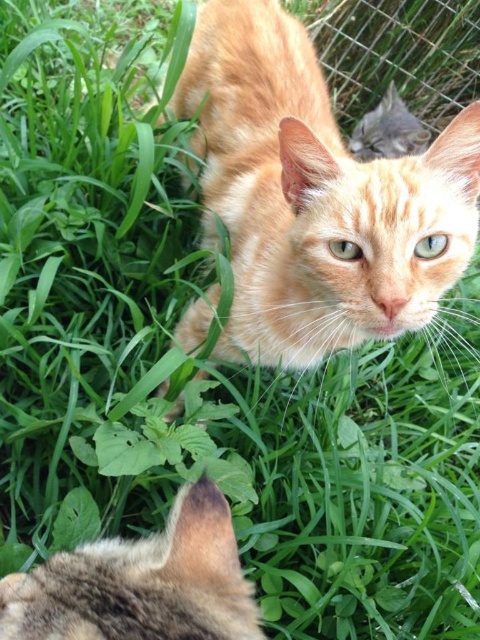
You are a photographer trying to capture the orange tabby cat in the image. You notice a specific point at coordinates point (141, 582). What part of the cat does this point correspond to?

The point (141, 582) corresponds to the tabby fur ear at lower left.

You are standing in the grassy area and see two points marked in the image. Which point is closer to you, point (252, 68) or point (71, 566)?

Point (252, 68) is closer to you than point (71, 566) because it is further to the viewer.